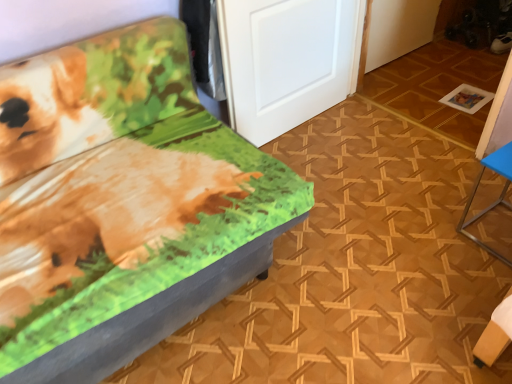
Question: Relative to printed fabric bench at left, the first furniture from the left, is blue metallic table at right, which is the first furniture in right-to-left order, in front or behind?

Choices:
 (A) behind
 (B) front

Answer: (A)

Question: From a real-world perspective, is blue metallic table at right, which is the first furniture in right-to-left order, above or below printed fabric bench at left, the first furniture from the left?

Choices:
 (A) above
 (B) below

Answer: (B)

Question: Based on their relative distances, which object is nearer to the blue metallic table at right, which is the first furniture in right-to-left order?

Choices:
 (A) printed fabric bench at left, which is the 2th furniture in right-to-left order
 (B) white matte door at center

Answer: (B)

Question: Which of these objects is positioned closest to the printed fabric bench at left, the first furniture from the left?

Choices:
 (A) white matte door at center
 (B) blue metallic table at right, which is the 2th furniture from left to right

Answer: (A)